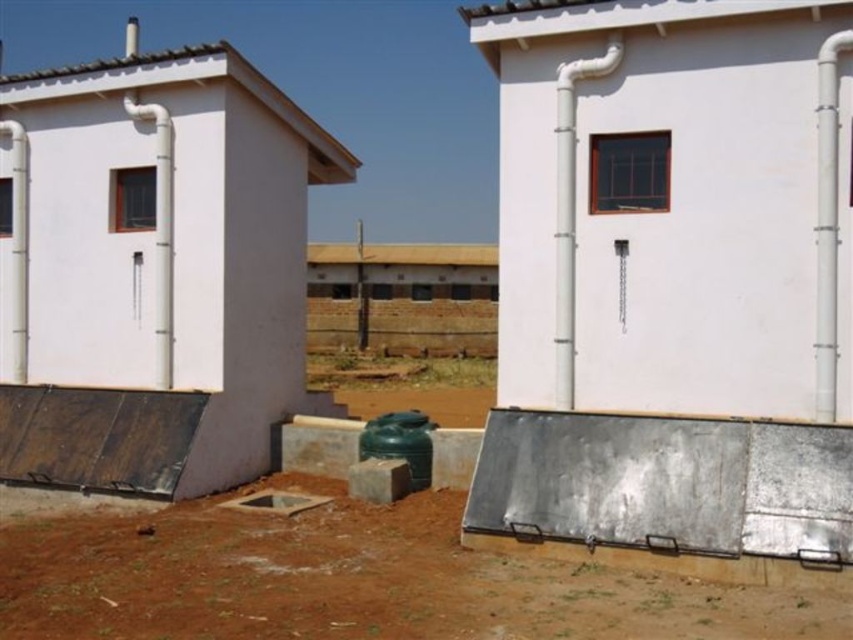
Question: Which object appears closest to the camera in this image?

Choices:
 (A) matte white hut at left
 (B) green matte water tank at center

Answer: (A)

Question: Can you confirm if white matte wall at center is bigger than metallic gray ramp at lower right?

Choices:
 (A) no
 (B) yes

Answer: (B)

Question: Among these objects, which one is nearest to the camera?

Choices:
 (A) metallic gray ramp at lower right
 (B) white matte wall at center

Answer: (A)

Question: Does white matte wall at center have a greater width compared to brown dirt field at center?

Choices:
 (A) no
 (B) yes

Answer: (A)

Question: Which of the following is the closest to the observer?

Choices:
 (A) green matte water tank at center
 (B) brown dirt field at center
 (C) matte white hut at left

Answer: (B)

Question: Does metallic gray ramp at lower right have a greater width compared to green matte water tank at center?

Choices:
 (A) no
 (B) yes

Answer: (B)